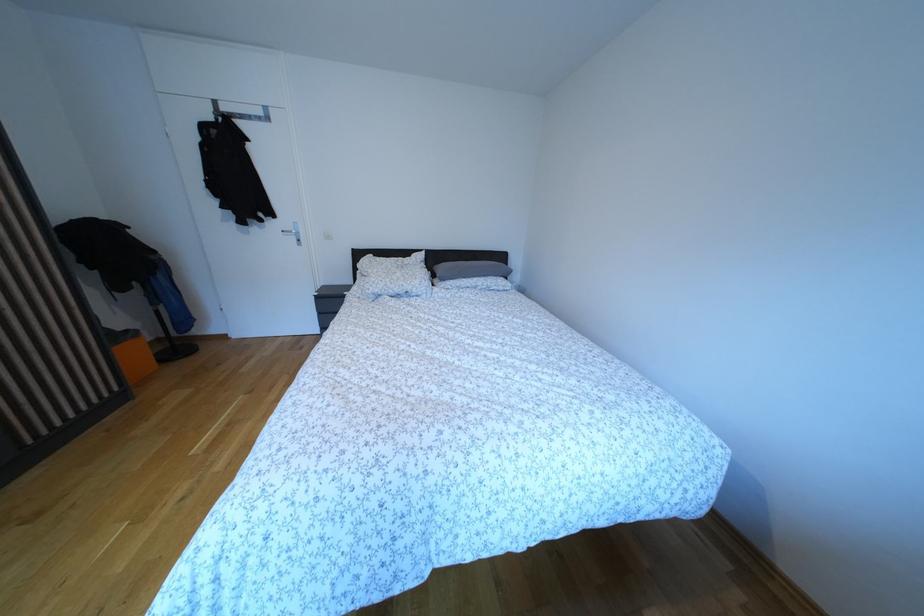
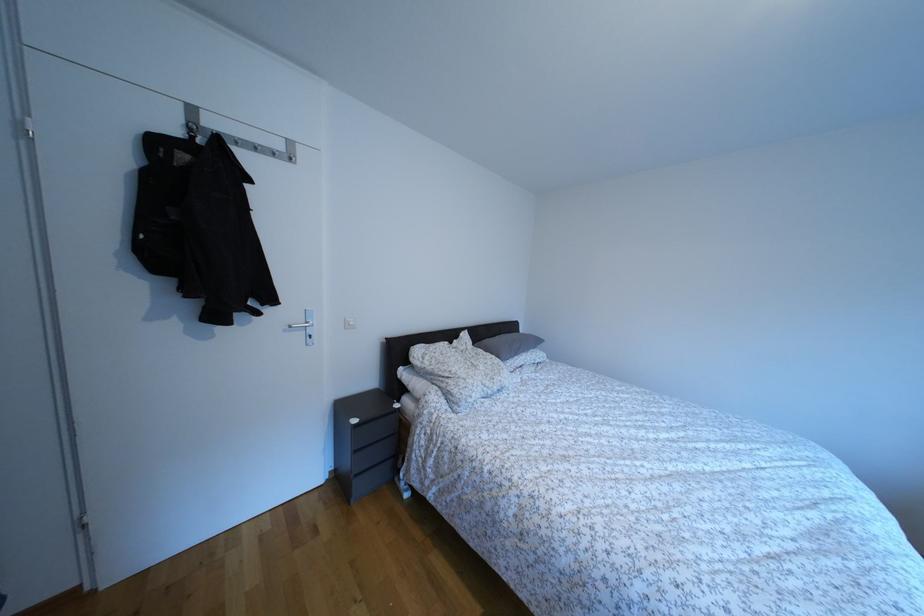
In the second image, find the point that corresponds to (x=268, y=119) in the first image.

(286, 152)